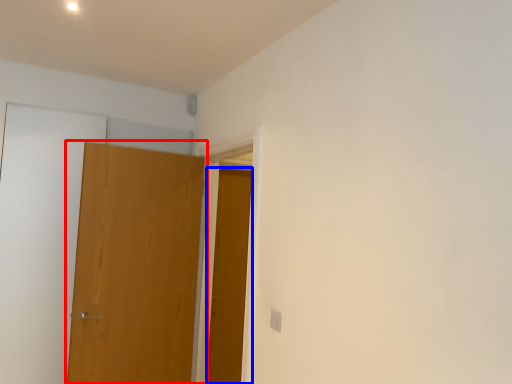
Question: Among these objects, which one is farthest to the camera, door (highlighted by a red box) or door (highlighted by a blue box)?

Choices:
 (A) door
 (B) door

Answer: (B)